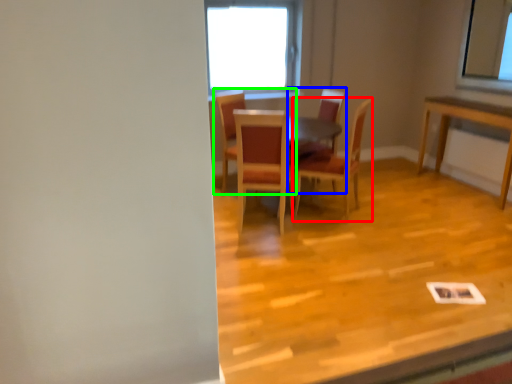
Question: Which is nearer to the chair (highlighted by a red box)? chair (highlighted by a blue box) or chair (highlighted by a green box).

Choices:
 (A) chair
 (B) chair

Answer: (B)